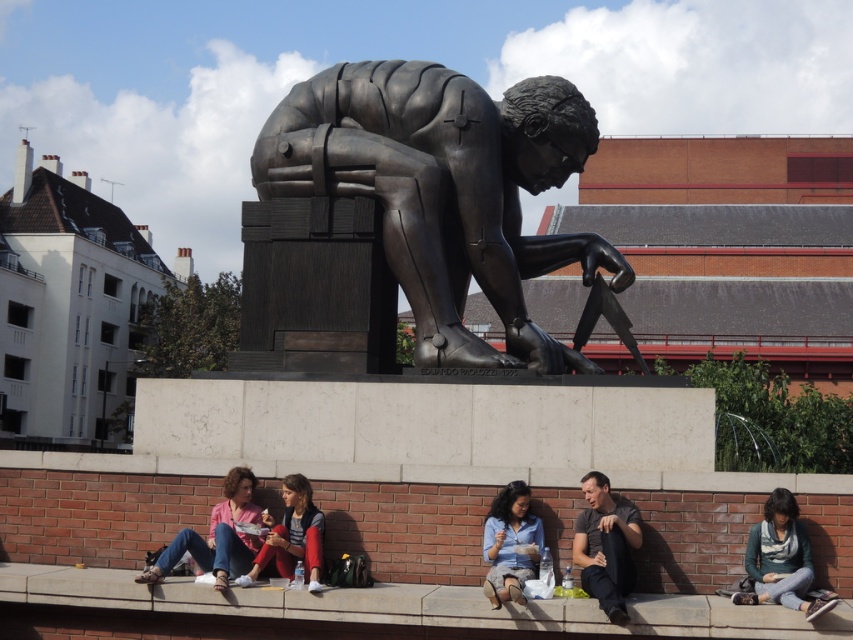
Question: Which point is farther from the camera taking this photo?

Choices:
 (A) (619, 604)
 (B) (753, 595)
 (C) (293, 506)
 (D) (512, 106)

Answer: (D)

Question: In this image, where is blue denim shirt at center located relative to matte black jacket at center?

Choices:
 (A) right
 (B) left

Answer: (A)

Question: Does bronze statue at center have a larger size compared to blue denim shirt at center?

Choices:
 (A) yes
 (B) no

Answer: (A)

Question: Does jeans at lower left appear on the left side of blue denim shirt at center?

Choices:
 (A) yes
 (B) no

Answer: (A)

Question: Which point is closer to the camera taking this photo?

Choices:
 (A) tap(231, 504)
 (B) tap(606, 544)
 (C) tap(115, 596)
 (D) tap(496, 596)

Answer: (D)

Question: Which point is farther from the camera taking this photo?

Choices:
 (A) (610, 509)
 (B) (781, 540)
 (C) (305, 493)
 (D) (251, 557)

Answer: (C)